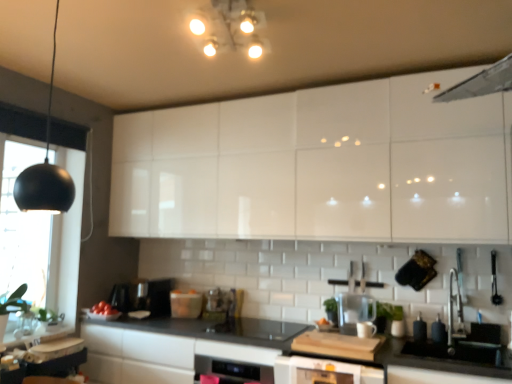
Question: Looking at the image, does black matte countertop at center seem bigger or smaller compared to matte plastic container at center, the fourth appliance when ordered from right to left?

Choices:
 (A) small
 (B) big

Answer: (B)

Question: In the image, is black matte countertop at center on the left side or the right side of matte plastic container at center, acting as the 2th appliance starting from the back?

Choices:
 (A) left
 (B) right

Answer: (B)

Question: Estimate the real-world distances between objects in this image. Which object is farther from the matte plastic container at center, the fourth appliance when ordered from right to left?

Choices:
 (A) matte black soap dispenser at lower right, the fourth appliance positioned from the back
 (B) black matte light fixture at left, the 2th light fixture in the top-to-bottom sequence
 (C) transparent plastic water filter at center, positioned as the 2th appliance in front-to-back order
 (D) black matte lampshade at left
 (E) white glossy light fixture at upper center, acting as the second light fixture starting from the bottom

Answer: (E)

Question: Based on their relative distances, which object is nearer to the black matte countertop at center?

Choices:
 (A) black matte lampshade at left
 (B) white glossy light fixture at upper center, marked as the 2th light fixture in a front-to-back arrangement
 (C) white glossy oven at lower center
 (D) white glossy cabinets at upper center
 (E) black matte light fixture at left, the 1th light fixture from the left

Answer: (C)